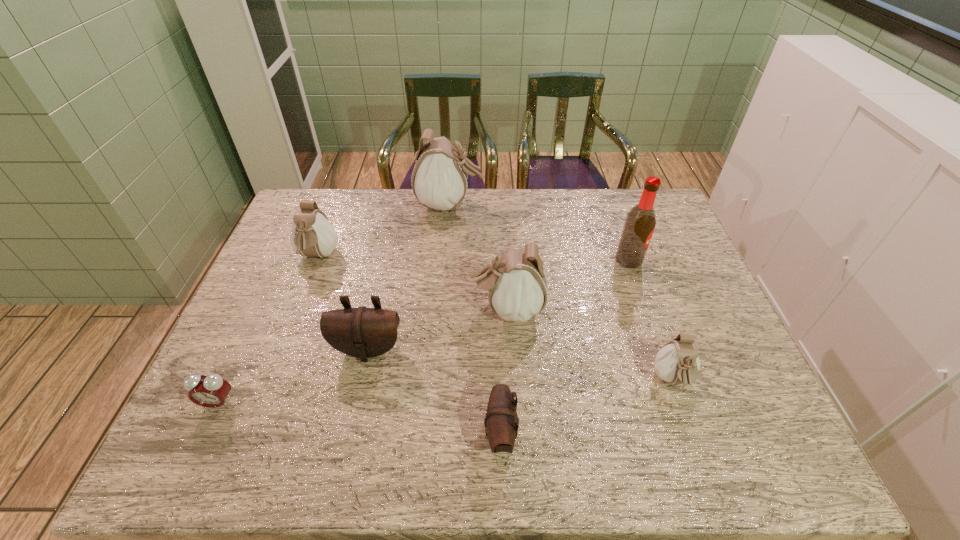
The width and height of the screenshot is (960, 540). I want to click on beer bottle that is at the right edge, so click(640, 222).

This screenshot has width=960, height=540. I want to click on pouch located at the right edge, so click(677, 362).

This screenshot has width=960, height=540. In the image, there is a desktop. Identify the location of vacant space at the far edge. (496, 207).

This screenshot has height=540, width=960. I want to click on free space at the near edge, so click(x=316, y=447).

Find the location of a particular element. The height and width of the screenshot is (540, 960). vacant space at the left edge is located at coordinates (283, 307).

Identify the location of vacant space at the right edge of the desktop. (664, 242).

Locate an element on the screen. free location at the far left corner is located at coordinates (286, 223).

Locate an element on the screen. free spot at the near left corner of the desktop is located at coordinates (168, 460).

Image resolution: width=960 pixels, height=540 pixels. I want to click on vacant point located between the leftmost white pouch and the alarm clock, so click(x=268, y=330).

Locate an element on the screen. The image size is (960, 540). vacant region between the third farthest white pouch and the leftmost pouch is located at coordinates (413, 283).